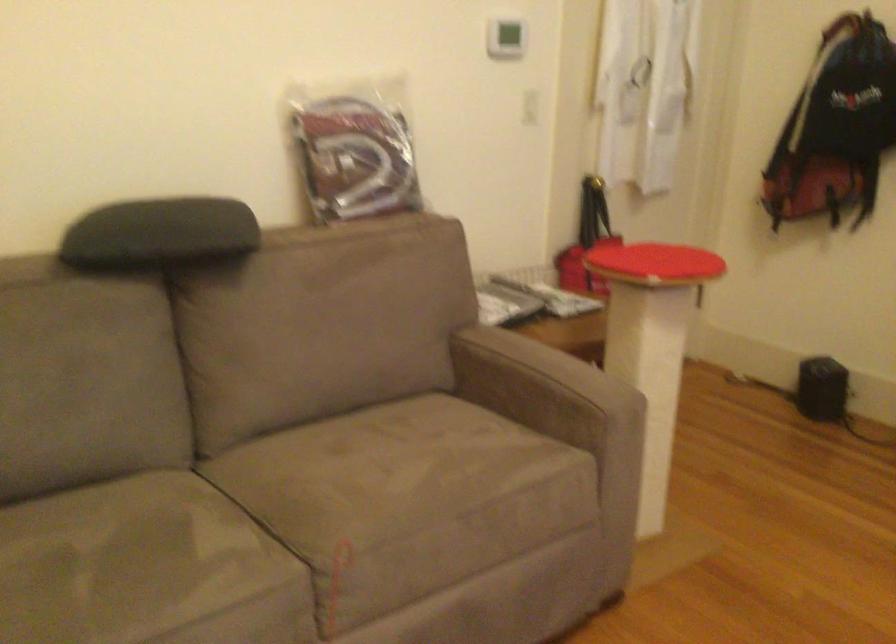
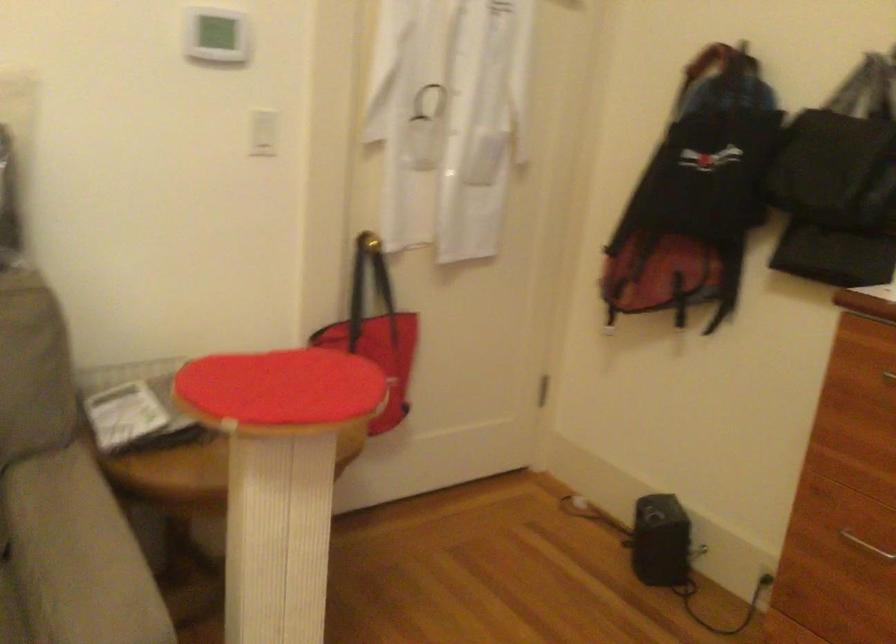
The images are taken continuously from a first-person perspective. In which direction are you moving?

The movement direction of the cameraman is right, forward.